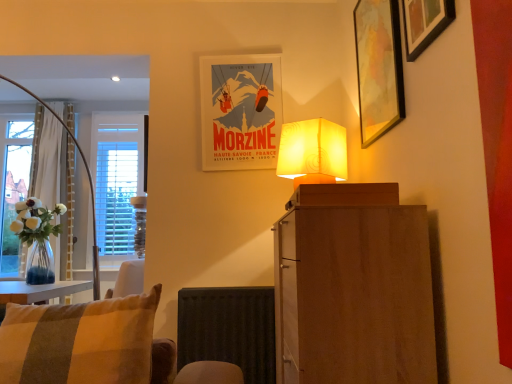
Question: Considering the relative sizes of matte paper poster at upper center, the 1th picture frame viewed from the left, and wooden picture frame at upper right, which is counted as the 2th picture frame, starting from the back, in the image provided, is matte paper poster at upper center, the 1th picture frame viewed from the left, taller than wooden picture frame at upper right, which is counted as the 2th picture frame, starting from the back,?

Choices:
 (A) yes
 (B) no

Answer: (A)

Question: From the image's perspective, is matte paper poster at upper center, the 1th picture frame viewed from the left, above wooden picture frame at upper right, the 2th picture frame in the front-to-back sequence?

Choices:
 (A) no
 (B) yes

Answer: (A)

Question: Can you confirm if matte paper poster at upper center, the 1th picture frame viewed from the left, is wider than wooden picture frame at upper right, which is counted as the second picture frame, starting from the left?

Choices:
 (A) no
 (B) yes

Answer: (A)

Question: From a real-world perspective, is matte paper poster at upper center, the third picture frame viewed from the right, on top of wooden picture frame at upper right, which is counted as the 2th picture frame, starting from the back?

Choices:
 (A) no
 (B) yes

Answer: (A)

Question: From the image's perspective, is matte paper poster at upper center, the third picture frame viewed from the right, beneath wooden picture frame at upper right, the 2th picture frame in the front-to-back sequence?

Choices:
 (A) yes
 (B) no

Answer: (A)

Question: Is point (441, 19) positioned closer to the camera than point (378, 28)?

Choices:
 (A) farther
 (B) closer

Answer: (B)

Question: Considering the positions of wooden picture frame at upper right, placed as the third picture frame when sorted from left to right, and wooden picture frame at upper right, which is counted as the second picture frame, starting from the left, in the image, is wooden picture frame at upper right, placed as the third picture frame when sorted from left to right, taller or shorter than wooden picture frame at upper right, which is counted as the second picture frame, starting from the left,?

Choices:
 (A) tall
 (B) short

Answer: (B)

Question: Based on their positions, is wooden picture frame at upper right, which is counted as the 1th picture frame, starting from the right, located to the left or right of wooden picture frame at upper right, the second picture frame in the right-to-left sequence?

Choices:
 (A) right
 (B) left

Answer: (A)

Question: From the image's perspective, is wooden picture frame at upper right, placed as the third picture frame when sorted from left to right, positioned above or below wooden picture frame at upper right, which is counted as the second picture frame, starting from the left?

Choices:
 (A) above
 (B) below

Answer: (A)

Question: Is striped fabric cushion at lower left taller or shorter than wooden picture frame at upper right, the second picture frame in the right-to-left sequence?

Choices:
 (A) short
 (B) tall

Answer: (A)

Question: Do you think striped fabric cushion at lower left is within wooden picture frame at upper right, which is counted as the second picture frame, starting from the left, or outside of it?

Choices:
 (A) outside
 (B) inside

Answer: (A)

Question: From a real-world perspective, is striped fabric cushion at lower left positioned above or below wooden picture frame at upper right, which is counted as the 2th picture frame, starting from the back?

Choices:
 (A) above
 (B) below

Answer: (B)

Question: In the image, is striped fabric cushion at lower left on the left side or the right side of wooden picture frame at upper right, which is counted as the 2th picture frame, starting from the back?

Choices:
 (A) left
 (B) right

Answer: (A)

Question: Is wooden picture frame at upper right, which is counted as the 1th picture frame, starting from the right, inside the boundaries of wooden cabinet at center, or outside?

Choices:
 (A) outside
 (B) inside

Answer: (A)

Question: From the image's perspective, is wooden picture frame at upper right, placed as the third picture frame when sorted from left to right, above or below wooden cabinet at center?

Choices:
 (A) above
 (B) below

Answer: (A)